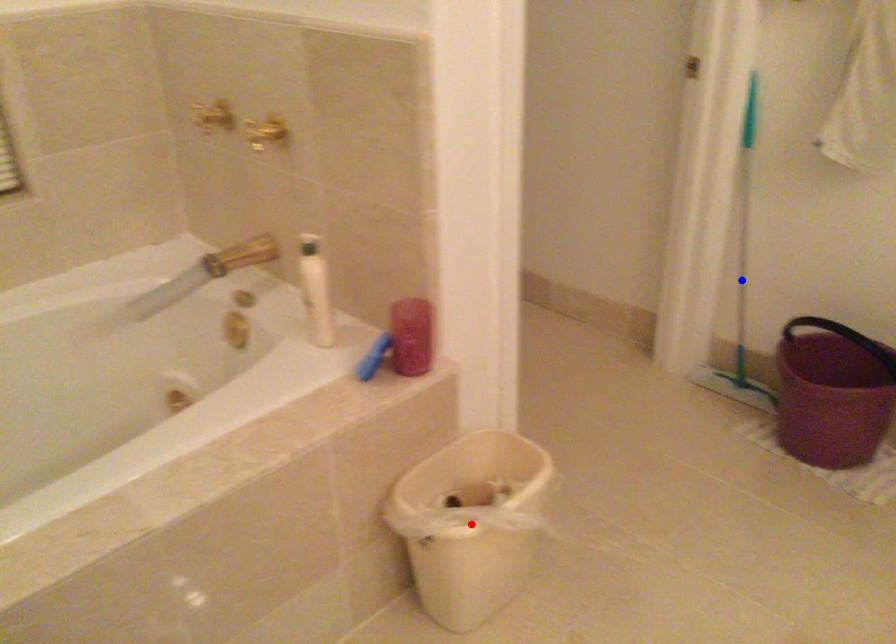
Question: Which of the two points in the image is closer to the camera?

Choices:
 (A) Blue point is closer.
 (B) Red point is closer.

Answer: (B)